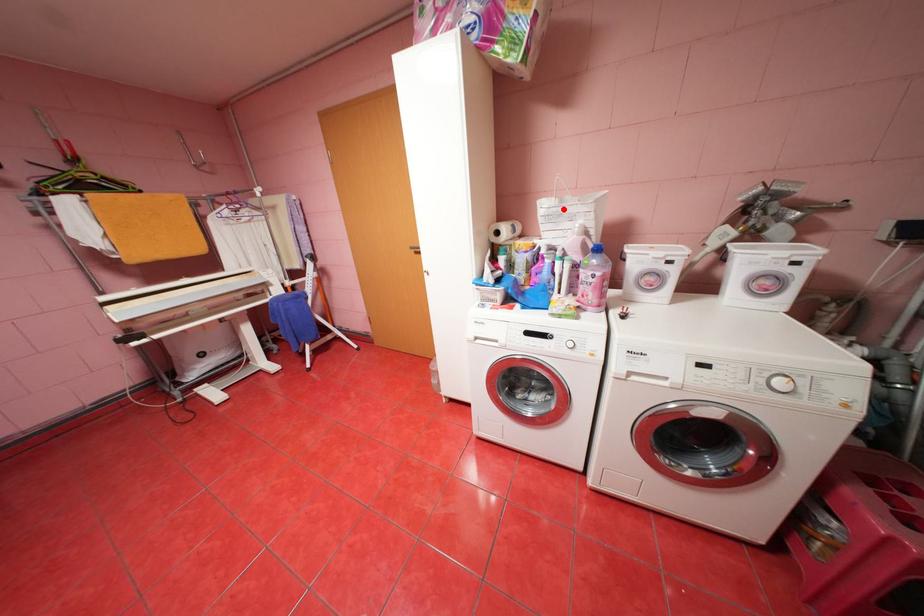
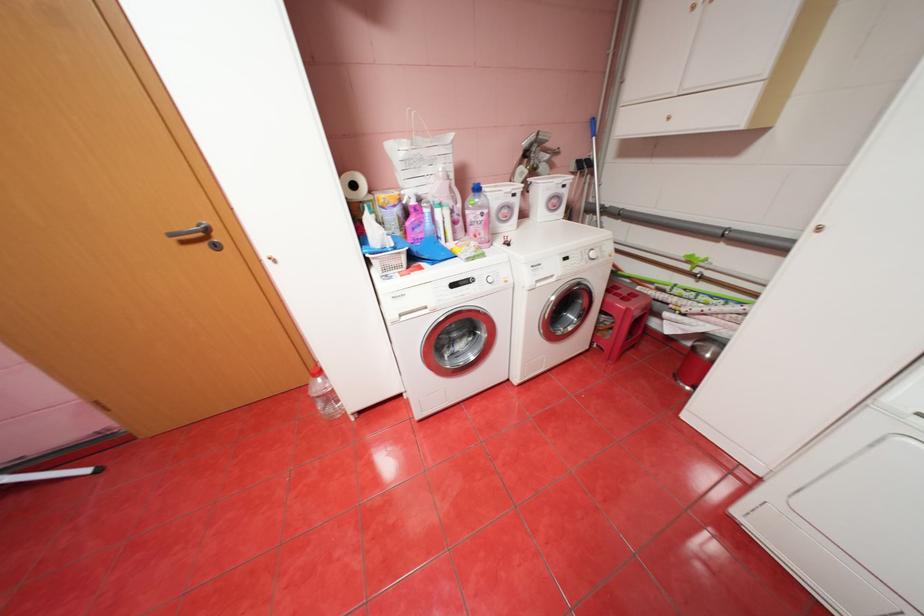
Find the pixel in the second image that matches the highlighted location in the first image.

(423, 151)